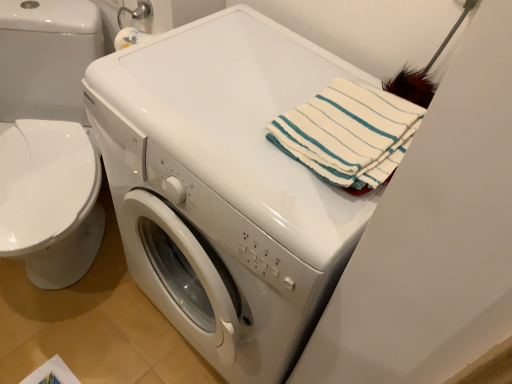
Locate an element on the screen. free spot above white glossy washing machine at center (from a real-world perspective) is located at coordinates (243, 85).